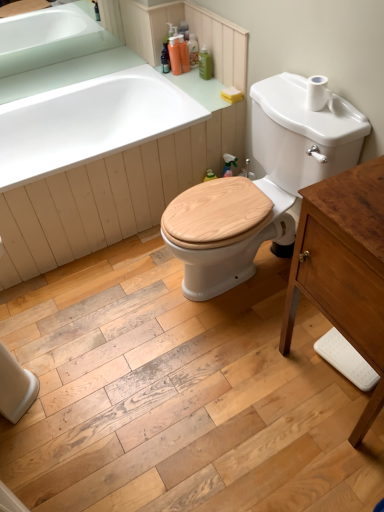
Question: Considering the positions of point (196, 53) and point (61, 35), is point (196, 53) closer or farther from the camera than point (61, 35)?

Choices:
 (A) farther
 (B) closer

Answer: (B)

Question: From a real-world perspective, relative to white glossy sink at upper left, is translucent plastic soap at upper center, the 3th toiletry viewed from the left, vertically above or below?

Choices:
 (A) above
 (B) below

Answer: (B)

Question: Estimate the real-world distances between objects in this image. Which object is farther from the white matte toilet paper at upper right?

Choices:
 (A) wooden cabinet at right
 (B) wooden at center
 (C) translucent plastic soap dispenser at upper center, which appears as the 2th toiletry when viewed from the left
 (D) green matte bottle at upper center, the 4th toiletry from the left
 (E) translucent plastic soap at upper center, which is the second toiletry from right to left

Answer: (E)

Question: Which of these objects is positioned farthest from the translucent plastic soap at upper center, which is the second toiletry from right to left?

Choices:
 (A) white glossy sink at upper left
 (B) wooden cabinet at right
 (C) wooden at center
 (D) green matte bottle at upper center, the 4th toiletry from the left
 (E) white matte toilet paper at upper right

Answer: (B)